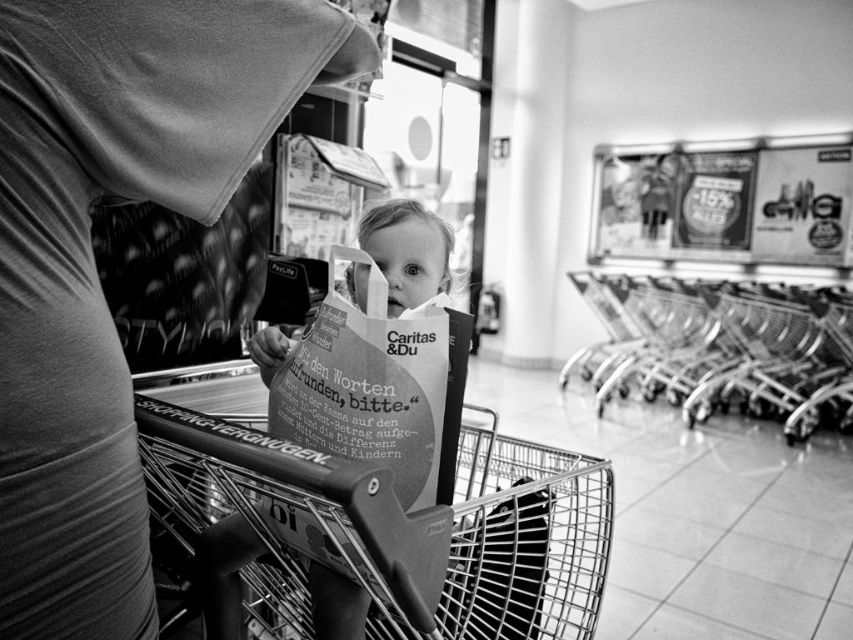
You are a photographer reviewing this black and white photo taken in a shopping area. You notice the matte black shirt at center and the white paper bag at center. Which object takes up more space in the photo?

The matte black shirt at center is larger in size than the white paper bag at center, so it takes up more space in the photo.

You are a photographer analyzing the composition of this black and white photo. The subject is the child in the shopping cart. Where is the matte black shirt at center located in relation to the child?

The matte black shirt at center is located at the 2D coordinates point (94, 264) in the image.